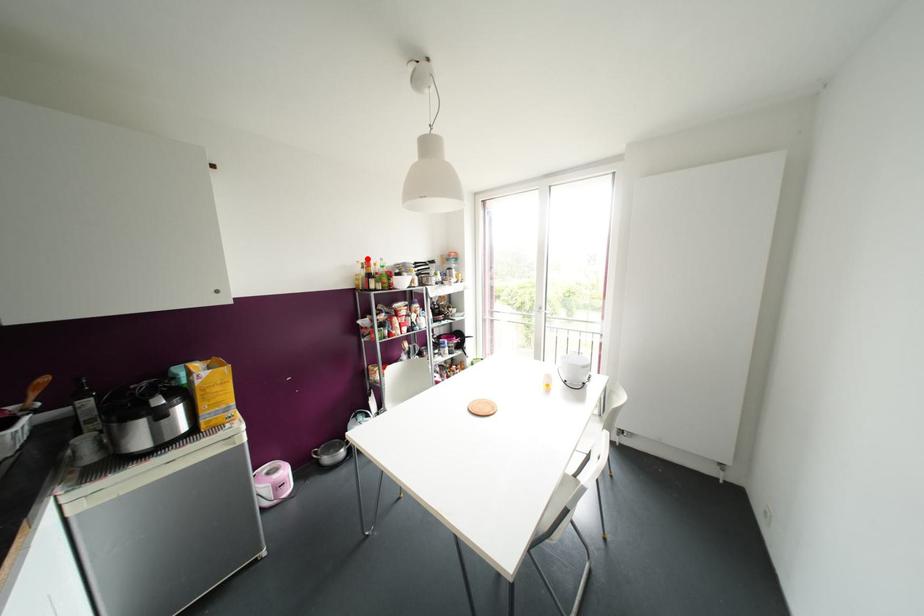
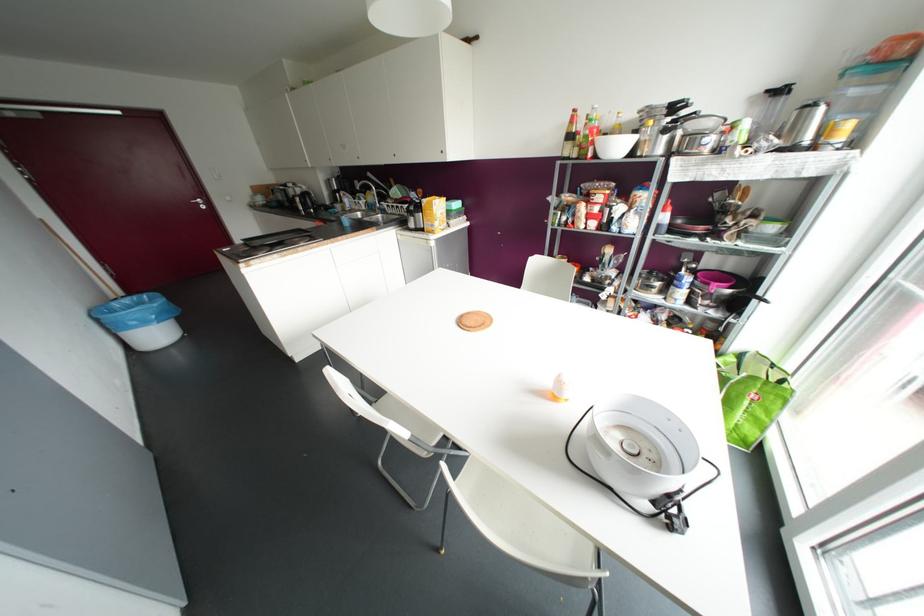
In the second image, find the point that corresponds to the highlighted location in the first image.

(574, 110)